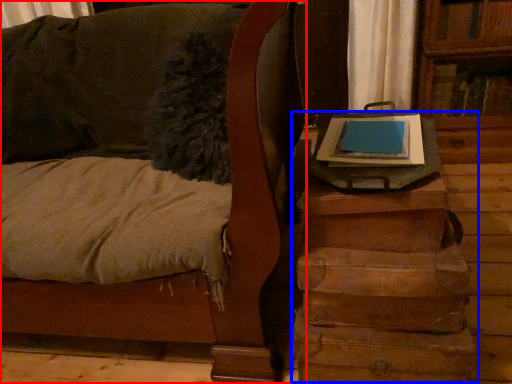
Question: Which object is closer to the camera taking this photo, furniture (highlighted by a red box) or table (highlighted by a blue box)?

Choices:
 (A) furniture
 (B) table

Answer: (A)